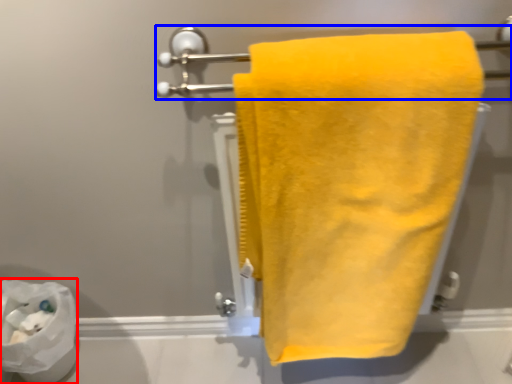
Question: Which of the following is the farthest to the observer, toilet paper (highlighted by a red box) or towel bar (highlighted by a blue box)?

Choices:
 (A) toilet paper
 (B) towel bar

Answer: (A)